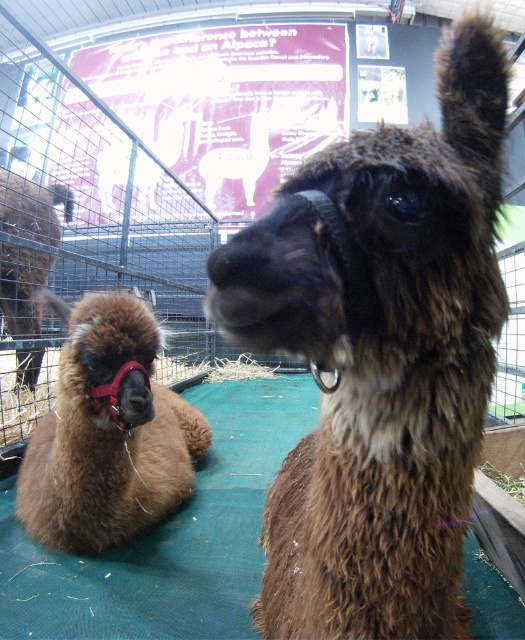
Question: Which point is farther to the camera?

Choices:
 (A) brown fuzzy alpaca at center
 (B) brown fuzzy camel at left

Answer: (B)

Question: Which of the following is the farthest from the observer?

Choices:
 (A) coord(379,422)
 (B) coord(117,483)

Answer: (B)

Question: Can you confirm if brown fuzzy alpaca at center is positioned above brown fuzzy alpaca at left?

Choices:
 (A) yes
 (B) no

Answer: (A)

Question: Is brown fuzzy alpaca at left to the right of brown fuzzy camel at left from the viewer's perspective?

Choices:
 (A) no
 (B) yes

Answer: (B)

Question: Does brown fuzzy alpaca at left have a smaller size compared to brown fuzzy camel at left?

Choices:
 (A) yes
 (B) no

Answer: (A)

Question: Based on their relative distances, which object is farther from the brown fuzzy camel at left?

Choices:
 (A) brown fuzzy alpaca at center
 (B) brown fuzzy alpaca at left

Answer: (A)